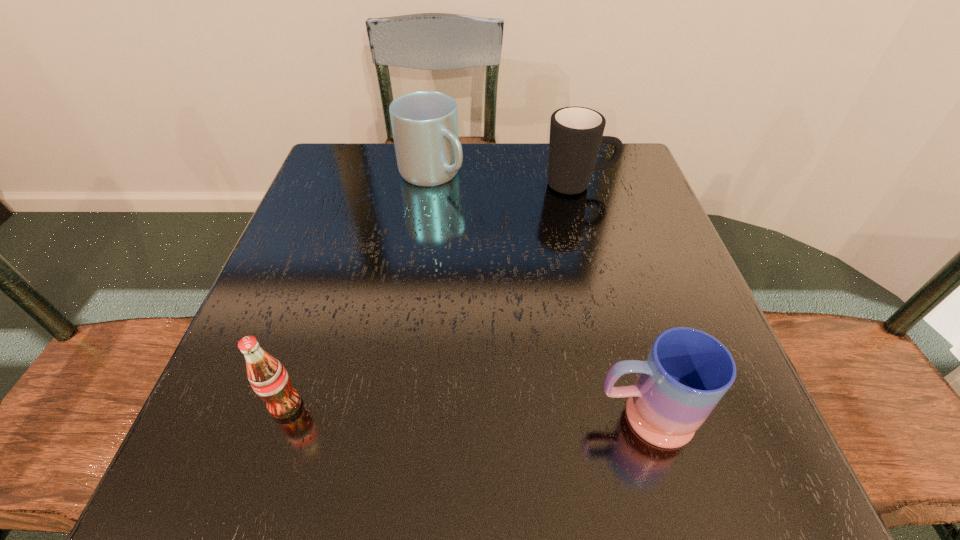
Identify the location of vacant area that lies between the nearest mug and the leftmost mug. The height and width of the screenshot is (540, 960). (538, 295).

Locate an element on the screen. The image size is (960, 540). vacant space in between the soda and the second object from left to right is located at coordinates (359, 289).

The height and width of the screenshot is (540, 960). Identify the location of free spot between the leftmost object and the leftmost mug. (359, 289).

Find the location of `vacant region between the leftmost mug and the soda`. vacant region between the leftmost mug and the soda is located at coordinates (359, 289).

Locate an element on the screen. Image resolution: width=960 pixels, height=540 pixels. free space between the second object from left to right and the soda is located at coordinates (359, 289).

I want to click on free space between the third object from right to left and the nearest mug, so click(x=538, y=295).

Where is `the second closest object to the leftmost object`? Image resolution: width=960 pixels, height=540 pixels. the second closest object to the leftmost object is located at coordinates (424, 123).

Identify which object is the closest to the nearest mug. Please provide its 2D coordinates. Your answer should be formatted as a tuple, i.e. [(x, y)], where the tuple contains the x and y coordinates of a point satisfying the conditions above.

[(269, 379)]

Point out which mug is positioned as the third nearest to the soda. Please provide its 2D coordinates. Your answer should be formatted as a tuple, i.e. [(x, y)], where the tuple contains the x and y coordinates of a point satisfying the conditions above.

[(576, 133)]

Identify which mug is the second nearest to the nearest mug. Please provide its 2D coordinates. Your answer should be formatted as a tuple, i.e. [(x, y)], where the tuple contains the x and y coordinates of a point satisfying the conditions above.

[(424, 123)]